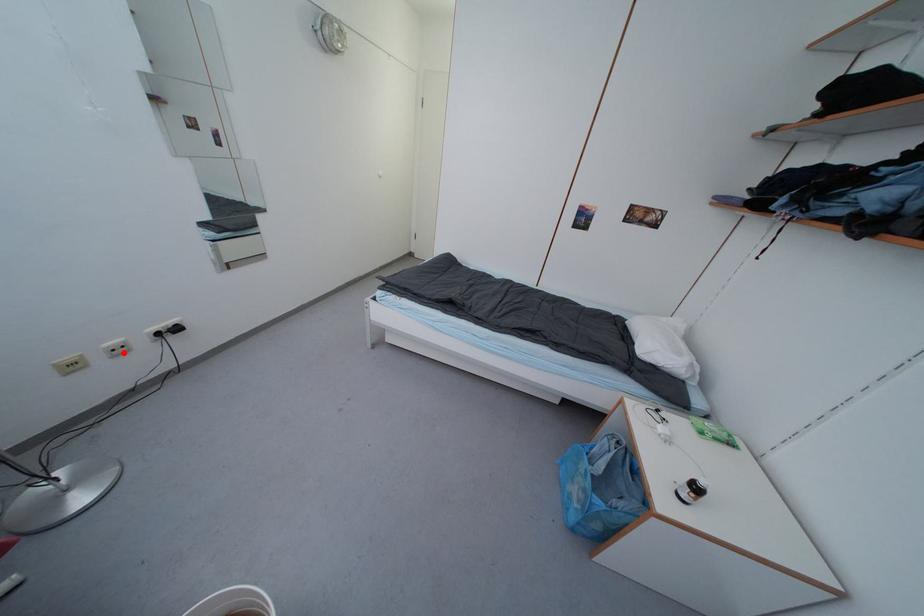
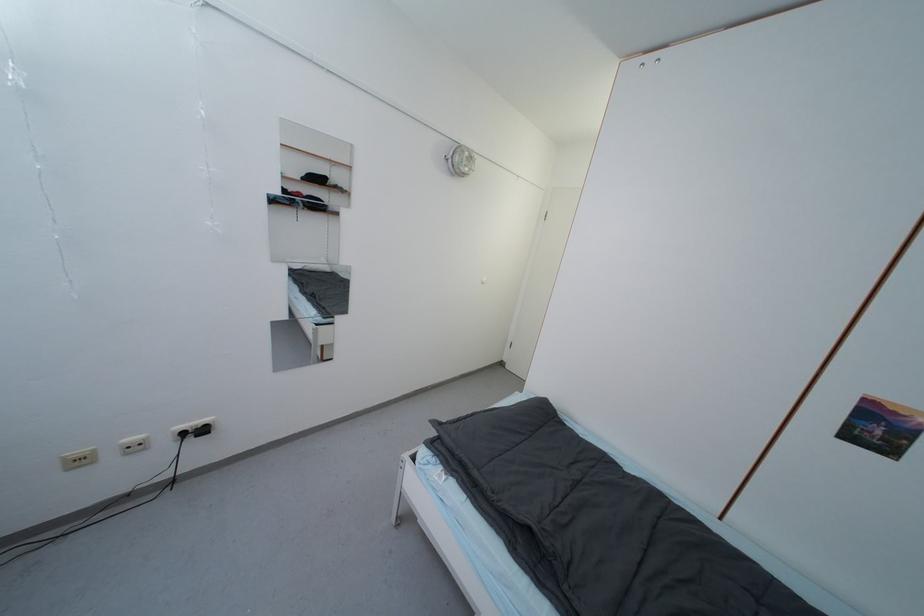
Question: I am providing you with two images of the same scene from different viewpoints. Given a red point in image1, look at the same physical point in image2. Is it:

Choices:
 (A) Closer to the viewpoint
 (B) Farther from the viewpoint

Answer: (A)